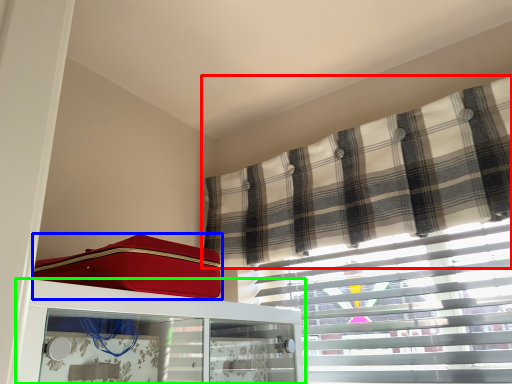
Question: Estimate the real-world distances between objects in this image. Which object is farther from curtain (highlighted by a red box), suitcase (highlighted by a blue box) or furniture (highlighted by a green box)?

Choices:
 (A) suitcase
 (B) furniture

Answer: (A)